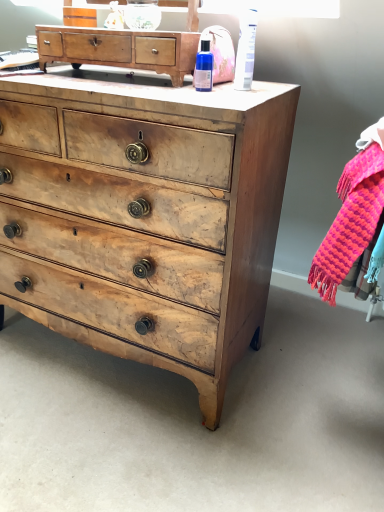
This screenshot has height=512, width=384. I want to click on empty space that is ontop of wooden chest of drawers at upper center, the second chest of drawers from the bottom (from a real-world perspective), so click(x=126, y=24).